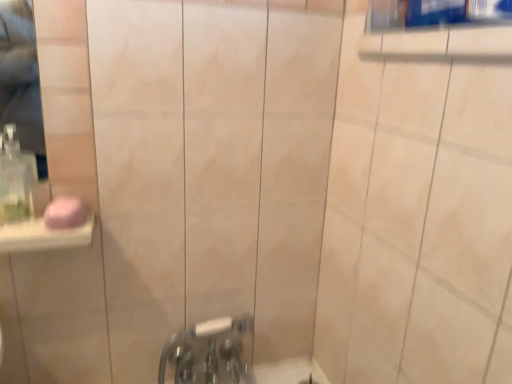
Question: Is chrome metallic faucet at lower center at the left side of clear plastic soap dispenser at left?

Choices:
 (A) no
 (B) yes

Answer: (A)

Question: Is chrome metallic faucet at lower center in front of clear plastic soap dispenser at left?

Choices:
 (A) no
 (B) yes

Answer: (A)

Question: Could you tell me if chrome metallic faucet at lower center is turned towards clear plastic soap dispenser at left?

Choices:
 (A) no
 (B) yes

Answer: (A)

Question: Can you confirm if chrome metallic faucet at lower center is smaller than clear plastic soap dispenser at left?

Choices:
 (A) no
 (B) yes

Answer: (A)

Question: Does chrome metallic faucet at lower center contain clear plastic soap dispenser at left?

Choices:
 (A) no
 (B) yes

Answer: (A)

Question: Considering the positions of point (4, 163) and point (65, 226), is point (4, 163) closer or farther from the camera than point (65, 226)?

Choices:
 (A) closer
 (B) farther

Answer: (B)

Question: In terms of height, does clear plastic soap dispenser at left look taller or shorter compared to pink matte soap at left?

Choices:
 (A) short
 (B) tall

Answer: (B)

Question: Is clear plastic soap dispenser at left bigger or smaller than pink matte soap at left?

Choices:
 (A) small
 (B) big

Answer: (B)

Question: In terms of width, does clear plastic soap dispenser at left look wider or thinner when compared to pink matte soap at left?

Choices:
 (A) wide
 (B) thin

Answer: (B)

Question: Would you say chrome metallic faucet at lower center is inside or outside pink matte soap at left?

Choices:
 (A) outside
 (B) inside

Answer: (A)

Question: Considering the positions of point (232, 365) and point (50, 208), is point (232, 365) closer or farther from the camera than point (50, 208)?

Choices:
 (A) closer
 (B) farther

Answer: (B)

Question: From the image's perspective, is chrome metallic faucet at lower center located above or below pink matte soap at left?

Choices:
 (A) above
 (B) below

Answer: (B)

Question: In terms of width, does chrome metallic faucet at lower center look wider or thinner when compared to pink matte soap at left?

Choices:
 (A) wide
 (B) thin

Answer: (A)

Question: From the image's perspective, is chrome metallic faucet at lower center positioned above or below clear plastic soap dispenser at left?

Choices:
 (A) below
 (B) above

Answer: (A)

Question: Considering the relative positions of chrome metallic faucet at lower center and clear plastic soap dispenser at left in the image provided, is chrome metallic faucet at lower center to the left or to the right of clear plastic soap dispenser at left?

Choices:
 (A) left
 (B) right

Answer: (B)